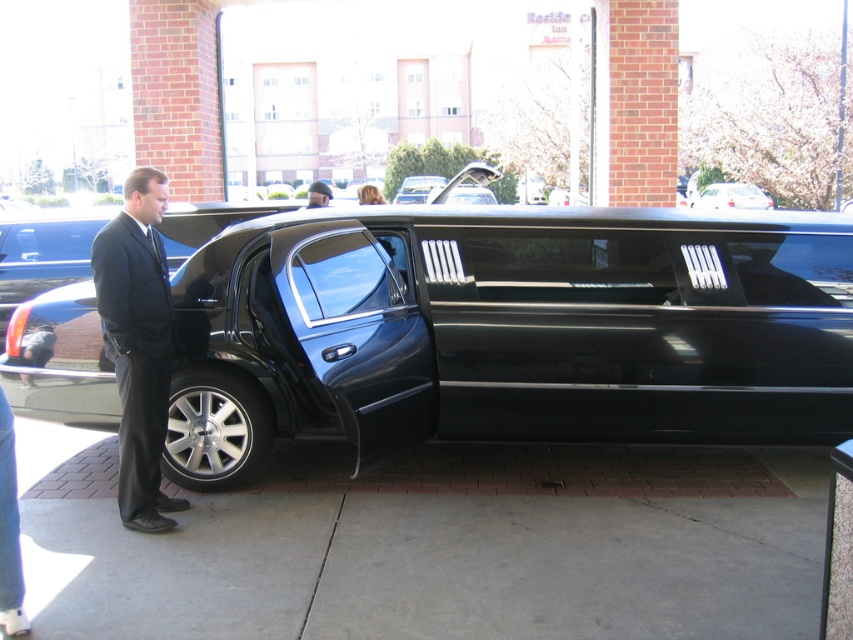
You are a photographer taking a picture of the scene. You notice a point at coordinates (138, 342). What object is located at that point?

The point at coordinates (138, 342) is located on the matte black suit at center.

You are a photographer taking a picture of the black glossy limousine at center and the matte black suit at center. Which object should you focus on first to ensure it is in sharp focus, considering their positions?

The black glossy limousine at center should be focused on first because it is positioned over the matte black suit at center, making it closer to the camera and thus requiring priority focus.